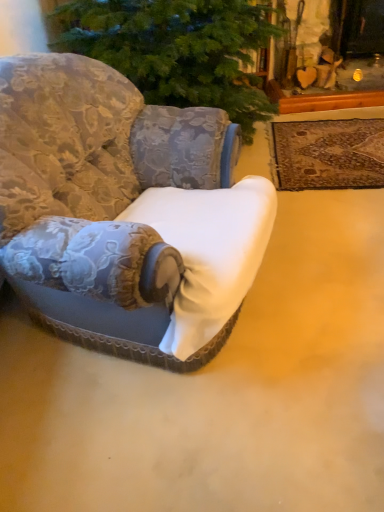
What do you see at coordinates (123, 210) in the screenshot?
I see `white fabric chair at center` at bounding box center [123, 210].

What is the approximate width of white fabric chair at center?

The width of white fabric chair at center is 1.09 meters.

Identify the location of white fabric chair at center. (123, 210).

This screenshot has height=512, width=384. Describe the element at coordinates (328, 154) in the screenshot. I see `brown woven rug at upper right` at that location.

In order to click on brown woven rug at upper right in this screenshot , I will do `click(328, 154)`.

Measure the distance between brown woven rug at upper right and camera.

7.75 feet.

This screenshot has width=384, height=512. I want to click on white fabric chair at center, so click(x=123, y=210).

Is brown woven rug at upper right to the left or to the right of white fabric chair at center in the image?

In the image, brown woven rug at upper right appears on the right side of white fabric chair at center.

Considering their positions, is brown woven rug at upper right located in front of or behind white fabric chair at center?

In the image, brown woven rug at upper right appears behind white fabric chair at center.

Between point (293, 163) and point (179, 241), which one is positioned in front?

The point (179, 241) is closer.

From the image's perspective, is brown woven rug at upper right over white fabric chair at center?

Yes, from the image's perspective, brown woven rug at upper right is over white fabric chair at center.

From a real-world perspective, is brown woven rug at upper right physically below white fabric chair at center?

Yes, from a real-world perspective, brown woven rug at upper right is under white fabric chair at center.

Is brown woven rug at upper right wider or thinner than white fabric chair at center?

Considering their sizes, brown woven rug at upper right looks slimmer than white fabric chair at center.

Considering the relative sizes of brown woven rug at upper right and white fabric chair at center in the image provided, is brown woven rug at upper right taller than white fabric chair at center?

No, brown woven rug at upper right is not taller than white fabric chair at center.

Which of these two, brown woven rug at upper right or white fabric chair at center, is smaller?

brown woven rug at upper right is smaller.

Is white fabric chair at center surrounded by brown woven rug at upper right?

No, brown woven rug at upper right does not contain white fabric chair at center.

Is brown woven rug at upper right directly adjacent to white fabric chair at center?

No, brown woven rug at upper right is not touching white fabric chair at center.

Is brown woven rug at upper right looking in the opposite direction of white fabric chair at center?

brown woven rug at upper right is not turned away from white fabric chair at center.

How many degrees apart are the facing directions of brown woven rug at upper right and white fabric chair at center?

There is a 74.7-degree angle between the facing directions of brown woven rug at upper right and white fabric chair at center.

Locate an element on the screen. This screenshot has width=384, height=512. mat above the white fabric chair at center (from the image's perspective) is located at coordinates (328, 154).

Does white fabric chair at center appear on the left side of brown woven rug at upper right?

Indeed, white fabric chair at center is positioned on the left side of brown woven rug at upper right.

Who is more distant, white fabric chair at center or brown woven rug at upper right?

brown woven rug at upper right is behind.

Is point (96, 199) more distant than point (324, 140)?

No, it is not.

From the image's perspective, which object appears higher, white fabric chair at center or brown woven rug at upper right?

From the image's view, brown woven rug at upper right is above.

From a real-world perspective, relative to brown woven rug at upper right, is white fabric chair at center vertically above or below?

Clearly, from a real-world perspective, white fabric chair at center is above brown woven rug at upper right.

Considering the sizes of objects white fabric chair at center and brown woven rug at upper right in the image provided, who is wider, white fabric chair at center or brown woven rug at upper right?

white fabric chair at center is wider.

Between white fabric chair at center and brown woven rug at upper right, which one has less height?

With less height is brown woven rug at upper right.

Considering the sizes of white fabric chair at center and brown woven rug at upper right in the image, is white fabric chair at center bigger or smaller than brown woven rug at upper right?

In the image, white fabric chair at center appears to be larger than brown woven rug at upper right.

Choose the correct answer: Is white fabric chair at center inside brown woven rug at upper right or outside it?

The correct answer is: outside.

Is white fabric chair at center far away from brown woven rug at upper right?

Absolutely, white fabric chair at center is distant from brown woven rug at upper right.

Is white fabric chair at center positioned with its back to brown woven rug at upper right?

No.

You are a GUI agent. You are given a task and a screenshot of the screen. Output one action in this format:
    pyautogui.click(x=<x>, y=<y>)
    Task: Click on the mat above the white fabric chair at center (from the image's perspective)
    Image resolution: width=384 pixels, height=512 pixels.
    Given the screenshot: What is the action you would take?
    pyautogui.click(x=328, y=154)

The height and width of the screenshot is (512, 384). Identify the location of chair in front of the brown woven rug at upper right. pos(123,210).

Find the location of `mat located underneath the white fabric chair at center (from a real-world perspective)`. mat located underneath the white fabric chair at center (from a real-world perspective) is located at coordinates (328, 154).